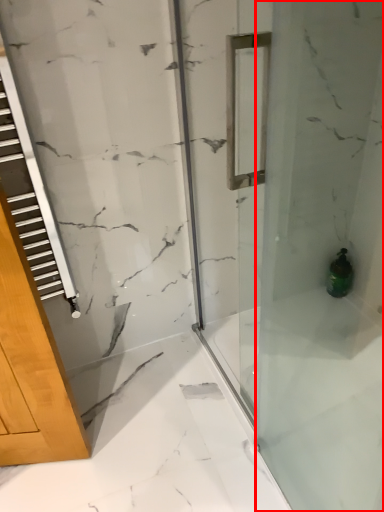
Question: Observing the image, what is the correct spatial positioning of shower door (annotated by the red box) in reference to bottle?

Choices:
 (A) left
 (B) right

Answer: (A)